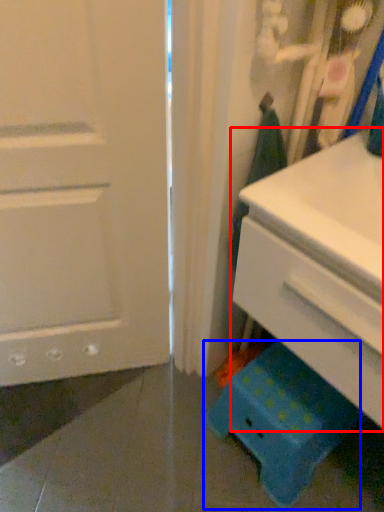
Question: Among these objects, which one is farthest to the camera, chest of drawers (highlighted by a red box) or step stool (highlighted by a blue box)?

Choices:
 (A) chest of drawers
 (B) step stool

Answer: (B)